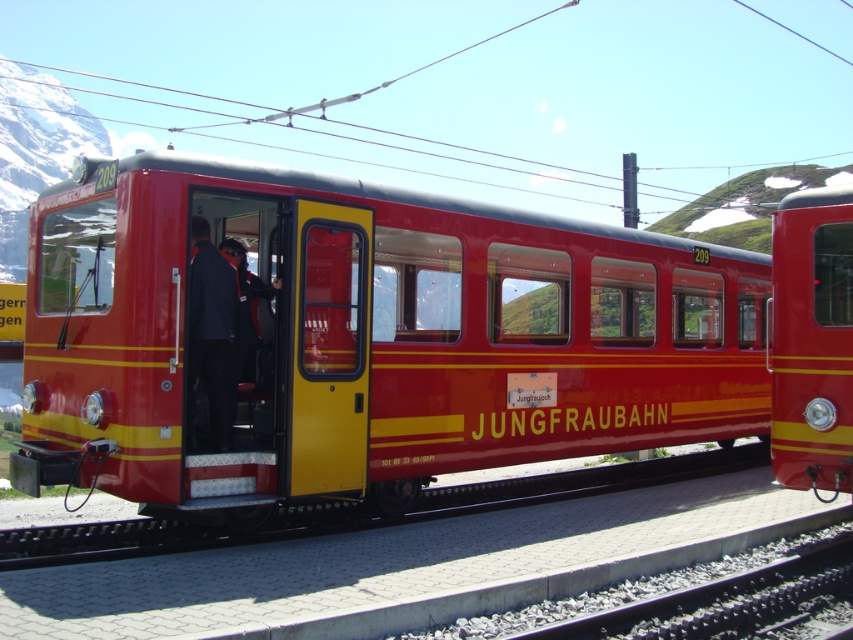
Question: Is metallic red train at right above dark blue uniform at center?

Choices:
 (A) no
 (B) yes

Answer: (A)

Question: Which point is closer to the camera?

Choices:
 (A) metallic red train at right
 (B) dark blue uniform at center
 (C) matte red train car at center

Answer: (C)

Question: Considering the relative positions of matte red train car at center and metallic red train at right in the image provided, where is matte red train car at center located with respect to metallic red train at right?

Choices:
 (A) right
 (B) left

Answer: (B)

Question: Based on their relative distances, which object is nearer to the dark blue uniform at center?

Choices:
 (A) matte red train car at center
 (B) metallic red train at right

Answer: (A)

Question: Considering the relative positions of matte red train car at center and dark blue uniform at center in the image provided, where is matte red train car at center located with respect to dark blue uniform at center?

Choices:
 (A) below
 (B) above

Answer: (A)

Question: Which point appears closest to the camera in this image?

Choices:
 (A) (769, 330)
 (B) (347, 182)

Answer: (B)